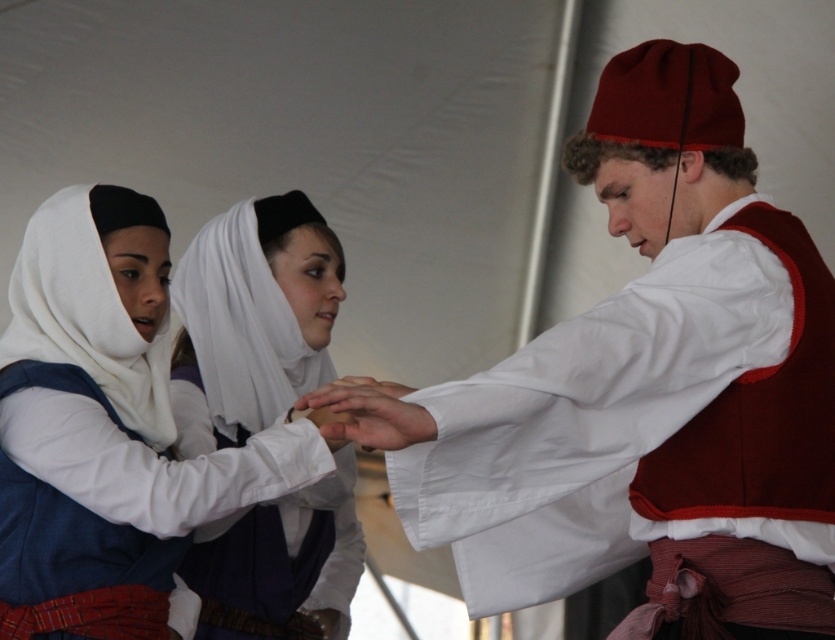
In the scene shown: Is white satin headscarf at center in front of white smooth hand at center?

No, white satin headscarf at center is behind white smooth hand at center.

Can you confirm if white satin headscarf at center is positioned to the right of white smooth hand at center?

No, white satin headscarf at center is not to the right of white smooth hand at center.

Which is in front, point (325, 589) or point (385, 420)?

Point (385, 420) is in front.

The image size is (835, 640). Identify the location of white satin headscarf at center. (252, 317).

Who is positioned more to the left, matte red hat at center or white satin headscarf at center?

From the viewer's perspective, white satin headscarf at center appears more on the left side.

Does matte red hat at center have a smaller size compared to white satin headscarf at center?

Incorrect, matte red hat at center is not smaller in size than white satin headscarf at center.

Find the location of a particular element. matte red hat at center is located at coordinates (655, 392).

Which is behind, point (668, 406) or point (402, 394)?

Point (402, 394)

Does matte red hat at center have a lesser height compared to white smooth hand at center?

No, matte red hat at center is not shorter than white smooth hand at center.

Is point (573, 538) positioned before point (397, 416)?

No, it is behind (397, 416).

The width and height of the screenshot is (835, 640). In order to click on matte red hat at center in this screenshot , I will do `click(655, 392)`.